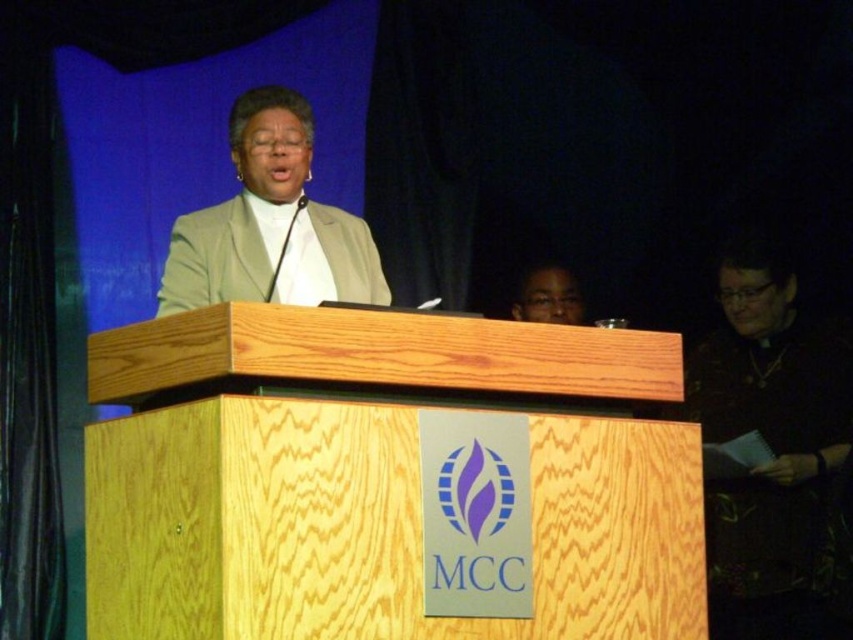
You are attending a formal event and notice a black leather jacket at upper right in the image. Where exactly is the black leather jacket positioned relative to the woman and the podium?

The black leather jacket at upper right is located at point coordinates 0.700 on the x axis and 0.905 on the y axis.

You are an event photographer at the formal event. You need to capture a clear shot of the beige fabric jacket at center and the matte black glasses at upper center. Which object should you focus on first to ensure both are in focus?

The beige fabric jacket at center is above the matte black glasses at upper center, so you should focus on the matte black glasses at upper center first to ensure both are in focus.

You are an event organizer and need to ensure that the beige fabric jacket at center and the matte black glasses at upper center are visible in the event photos. Considering their sizes, which object might require more careful framing to ensure it is fully captured in the photo?

The beige fabric jacket at center is larger in size than the matte black glasses at upper center, so the glasses might require more careful framing to ensure they are fully captured in the photo since they are smaller and could be easily missed if not properly framed.